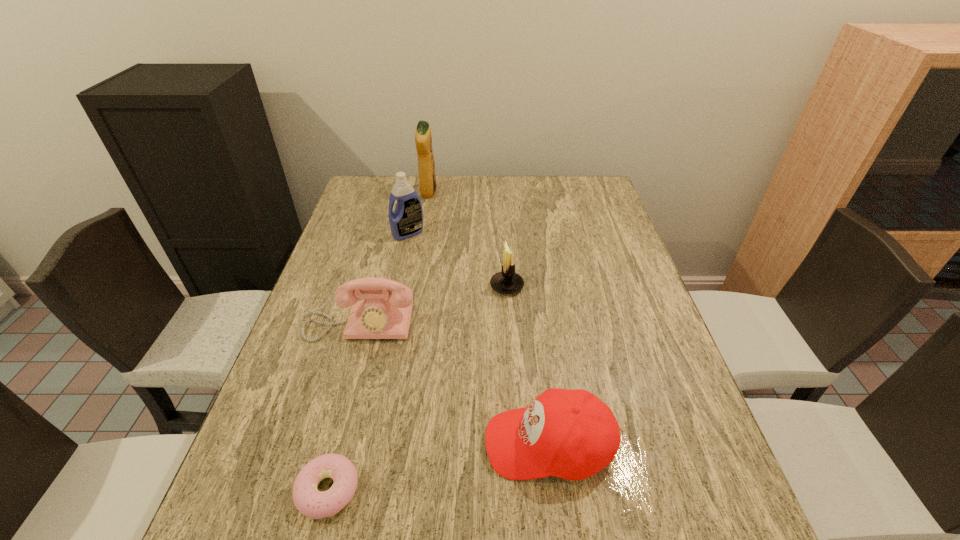
I want to click on free space located 0.340m on the left of the candle holder, so click(366, 286).

You are a GUI agent. You are given a task and a screenshot of the screen. Output one action in this format:
    pyautogui.click(x=<x>, y=<y>)
    Task: Click on the vacant area situated 0.290m on the dial of the third nearest object
    This screenshot has height=540, width=960.
    Given the screenshot: What is the action you would take?
    pyautogui.click(x=321, y=460)

You are a GUI agent. You are given a task and a screenshot of the screen. Output one action in this format:
    pyautogui.click(x=<x>, y=<y>)
    Task: Click on the free point located on the front panel of the second shortest object
    The width and height of the screenshot is (960, 540).
    Given the screenshot: What is the action you would take?
    pyautogui.click(x=434, y=443)

Where is `vacant space located 0.320m on the front panel of the second shortest object`? This screenshot has height=540, width=960. vacant space located 0.320m on the front panel of the second shortest object is located at coordinates (321, 443).

Find the location of a particular element. vacant space located 0.190m on the front panel of the second shortest object is located at coordinates (388, 443).

This screenshot has width=960, height=540. In order to click on vacant space situated 0.230m on the back of the doughnut in this screenshot , I will do `click(360, 362)`.

This screenshot has width=960, height=540. I want to click on object that is at the far edge, so click(x=423, y=139).

Locate an element on the screen. This screenshot has width=960, height=540. telephone situated at the left edge is located at coordinates (383, 314).

What are the coordinates of `doughnut that is at the left edge` in the screenshot? It's located at (310, 502).

Find the location of a particular element. The width and height of the screenshot is (960, 540). free space at the far edge is located at coordinates (445, 209).